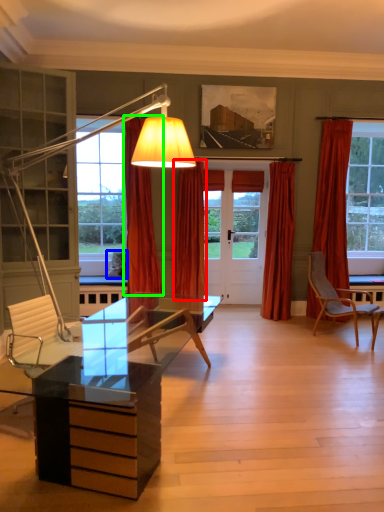
Question: Estimate the real-world distances between objects in this image. Which object is closer to curtain (highlighted by a red box), pillow (highlighted by a blue box) or curtain (highlighted by a green box)?

Choices:
 (A) pillow
 (B) curtain

Answer: (B)